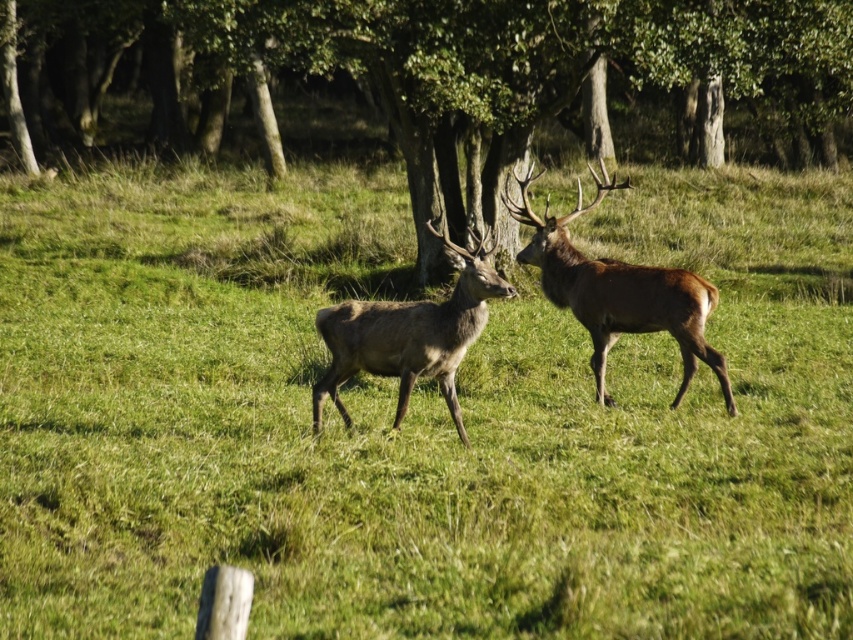
You are a hiker who wants to take a photo of the brown velvet deer at center without the green leafy tree at center blocking the view. Which direction should you move to ensure the deer is visible without the tree in front of it?

The green leafy tree at center is closer to you than the brown velvet deer at center. To avoid the tree blocking the view, move behind the deer so that the deer is between you and the tree. Alternatively, move to the side so that the deer is no longer aligned with the tree.

You are a hiker who wants to take a photo of the brown velvet deer at center without the green leafy tree at center blocking the view. Which direction should you move to ensure the deer is visible without the tree in front of it?

The green leafy tree at center is positioned over the brown velvet deer at center. To avoid the tree blocking the view, move either to the left or right side so that the deer is no longer directly under the tree.